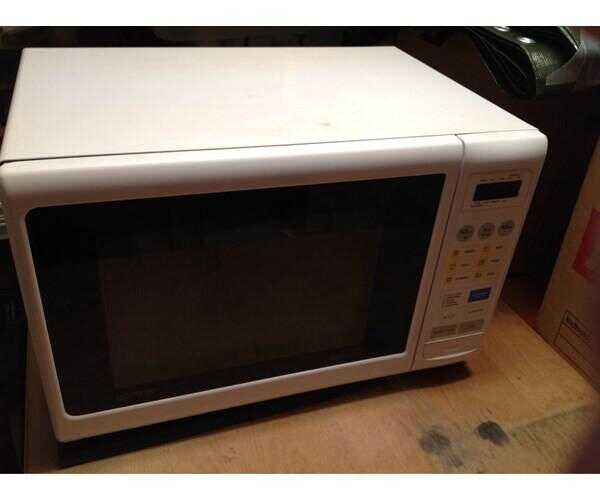
Where is `2 gray rectangles on microwave`? 2 gray rectangles on microwave is located at coordinates (442, 337), (474, 322).